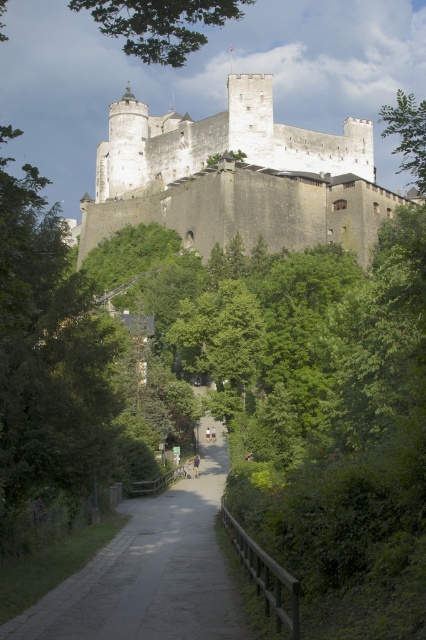
Question: Among these objects, which one is farthest from the camera?

Choices:
 (A) gray concrete path at center
 (B) white stone castle at upper center
 (C) green leafy tree at upper right

Answer: (B)

Question: Does white stone castle at upper center come in front of gray concrete path at center?

Choices:
 (A) no
 (B) yes

Answer: (A)

Question: Considering the real-world distances, which object is closest to the white stone castle at upper center?

Choices:
 (A) green leafy tree at upper right
 (B) gray concrete path at center

Answer: (A)

Question: Does white stone castle at upper center appear over green leafy tree at upper right?

Choices:
 (A) no
 (B) yes

Answer: (B)

Question: Which point is farther to the camera?

Choices:
 (A) (126, 577)
 (B) (322, 200)
 (C) (423, 138)

Answer: (B)

Question: Is white stone castle at upper center above green leafy tree at upper right?

Choices:
 (A) no
 (B) yes

Answer: (B)